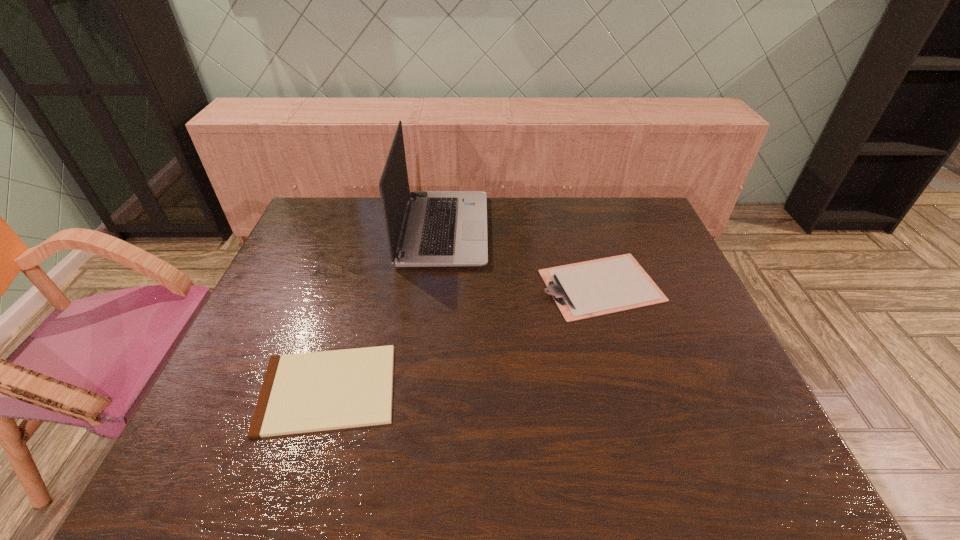
Identify the location of object present at the left edge. (308, 392).

At what (x,y) coordinates should I click in order to perform the action: click on object that is at the right edge. Please return your answer as a coordinate pair (x, y). The image size is (960, 540). Looking at the image, I should click on (582, 290).

Find the location of a particular element. object located in the near left corner section of the desktop is located at coordinates (308, 392).

Image resolution: width=960 pixels, height=540 pixels. What are the coordinates of `free space at the far edge of the desktop` in the screenshot? It's located at (522, 208).

Identify the location of vacant space at the near edge of the desktop. (389, 441).

Image resolution: width=960 pixels, height=540 pixels. Find the location of `vacant space at the left edge of the desktop`. vacant space at the left edge of the desktop is located at coordinates (199, 426).

In the image, there is a desktop. Where is `vacant space at the right edge`? The height and width of the screenshot is (540, 960). vacant space at the right edge is located at coordinates point(655,336).

What are the coordinates of `vacant space at the far left corner of the desktop` in the screenshot? It's located at (328, 198).

Where is `free region at the far right corner`? The width and height of the screenshot is (960, 540). free region at the far right corner is located at coordinates (645, 210).

This screenshot has width=960, height=540. In order to click on vacant space at the near right corner of the desktop in this screenshot , I will do `click(718, 451)`.